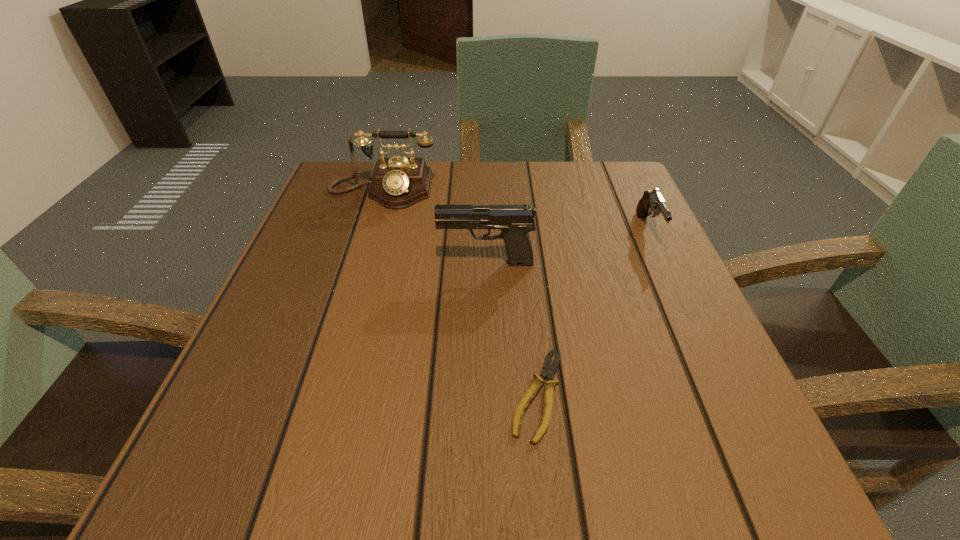
You are a GUI agent. You are given a task and a screenshot of the screen. Output one action in this format:
    pyautogui.click(x=<x>, y=<y>)
    Task: Click on the free space between the left pistol and the leftmost object
    
    Given the screenshot: What is the action you would take?
    pyautogui.click(x=434, y=227)

Where is `vacant region between the telephone and the second nearest object`? vacant region between the telephone and the second nearest object is located at coordinates (434, 227).

The width and height of the screenshot is (960, 540). Identify the location of empty space that is in between the leftmost object and the left pistol. (434, 227).

This screenshot has width=960, height=540. In order to click on free space between the taller pistol and the nearest object in this screenshot , I will do `click(512, 328)`.

Identify the location of blank region between the farthest object and the nearer pistol. (434, 227).

This screenshot has height=540, width=960. Find the location of `unoccupied position between the telephone and the shortest object`. unoccupied position between the telephone and the shortest object is located at coordinates point(460,292).

Where is `object that is the second closest one to the second shortest object`? object that is the second closest one to the second shortest object is located at coordinates (549, 370).

Find the location of `the second closest object to the telephone`. the second closest object to the telephone is located at coordinates (549, 370).

Locate an element on the screen. The width and height of the screenshot is (960, 540). free location that satisfies the following two spatial constraints: 1. on the back side of the pliers; 2. aim along the barrel of the taller pistol is located at coordinates (523, 263).

Find the location of `blank space that satisfies the following two spatial constraints: 1. on the dial of the pliers; 2. on the left side of the telephone`. blank space that satisfies the following two spatial constraints: 1. on the dial of the pliers; 2. on the left side of the telephone is located at coordinates (322, 394).